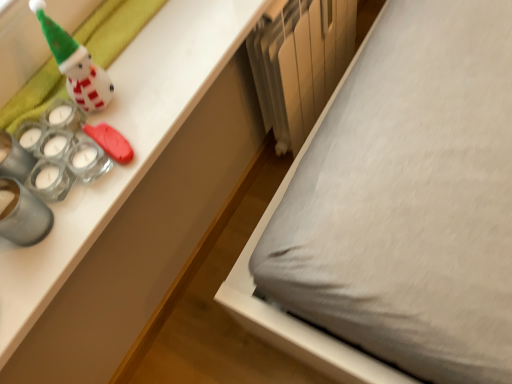
The width and height of the screenshot is (512, 384). In order to click on vacant area that is in front of white glossy snowman at upper left in this screenshot , I will do `click(96, 182)`.